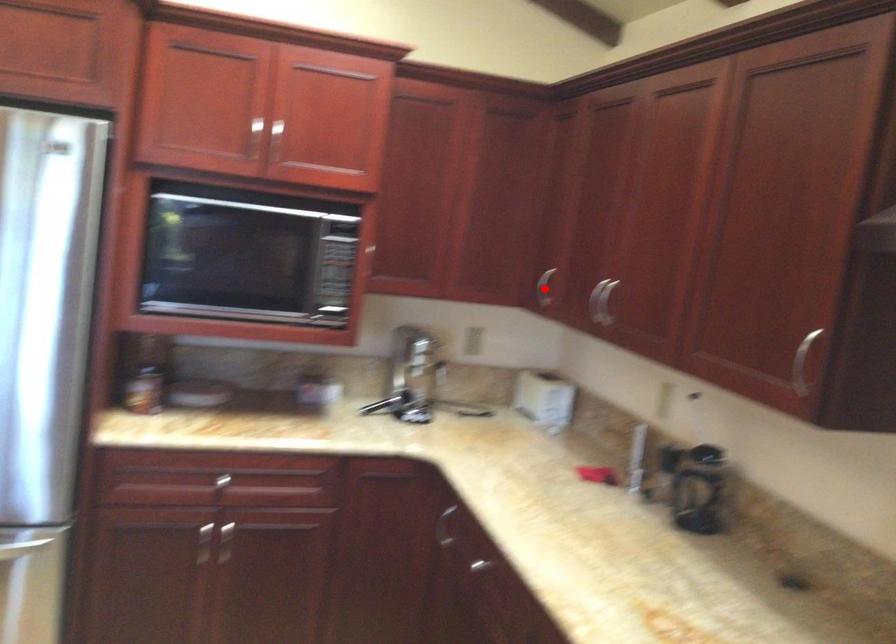
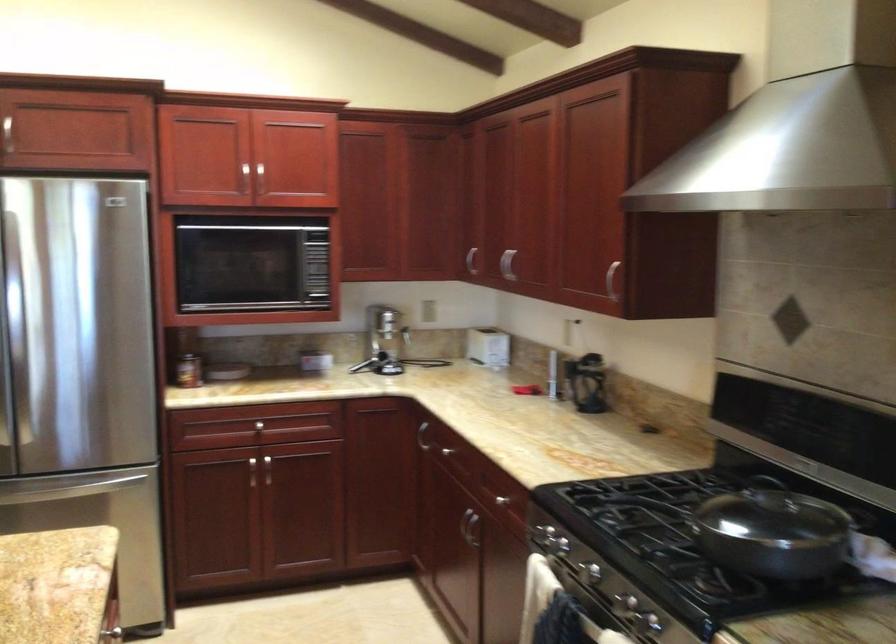
The point at the highlighted location is marked in the first image. Where is the corresponding point in the second image?

(471, 261)